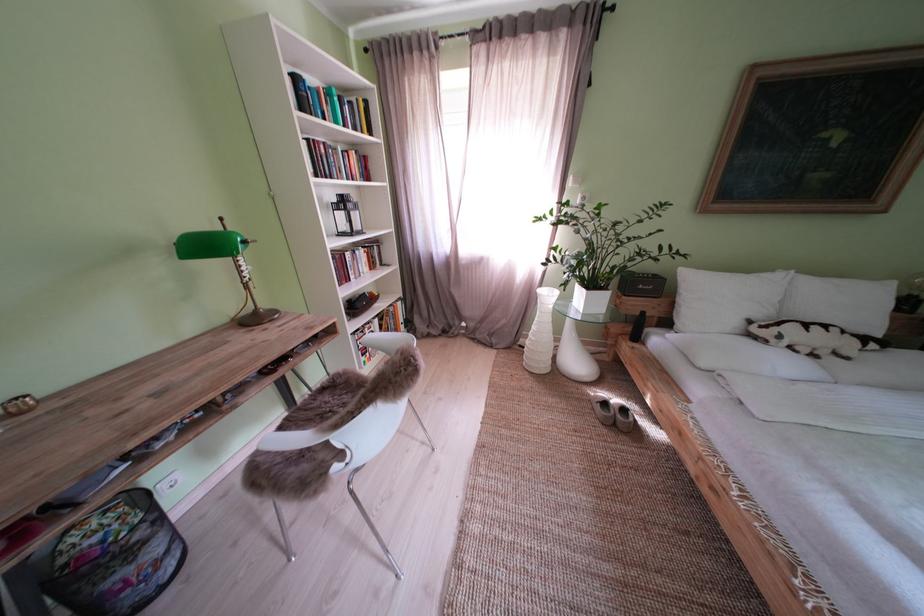
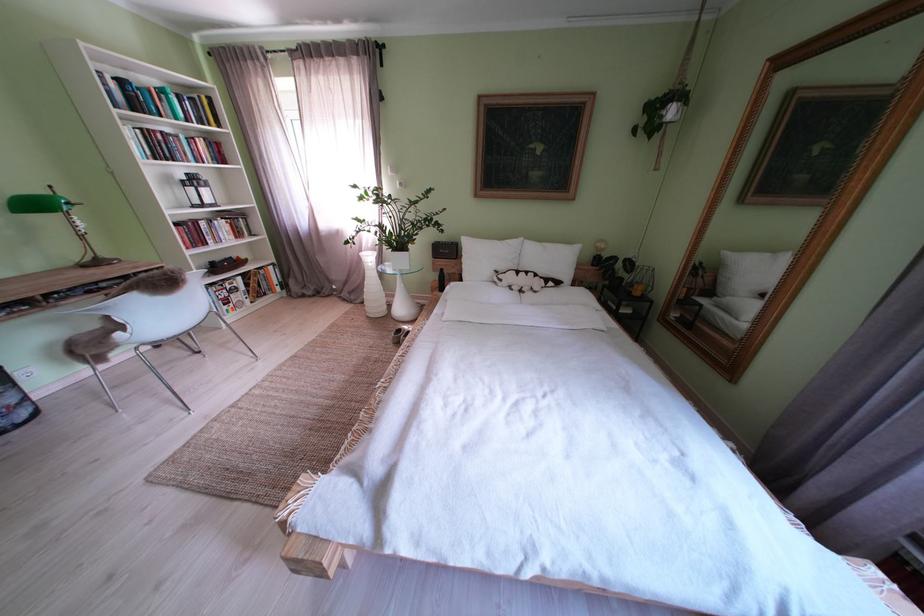
Where in the second image is the point corresponding to pixel 217 252 from the first image?

(46, 209)